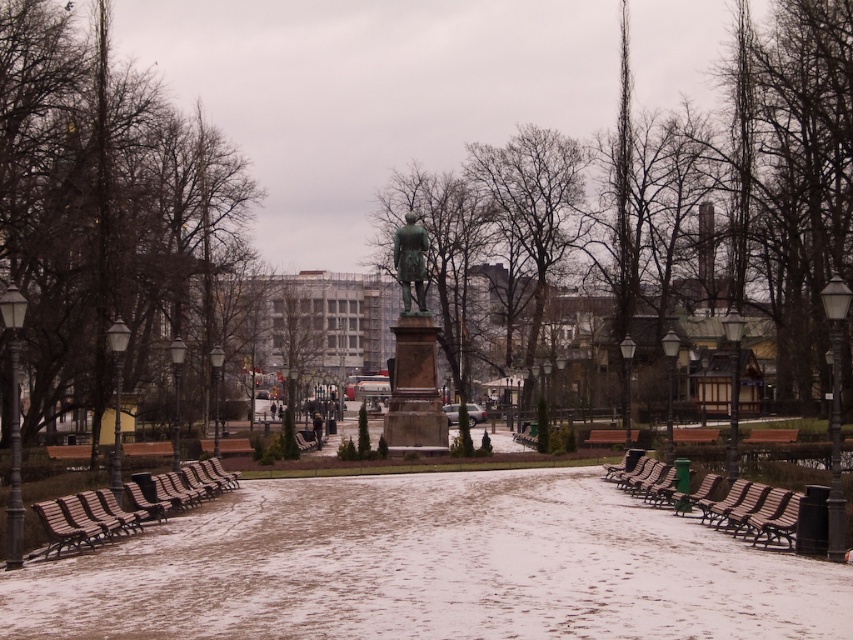
Question: Which of these objects is positioned farthest from the green patina statue at center?

Choices:
 (A) green polished statue at center
 (B) wooden park bench at lower left
 (C) bare branches at center

Answer: (C)

Question: Is wooden park bench at lower left bigger than green polished stone statue at center?

Choices:
 (A) yes
 (B) no

Answer: (A)

Question: Is green patina statue at center positioned in front of wooden park bench at lower left?

Choices:
 (A) no
 (B) yes

Answer: (A)

Question: Considering the real-world distances, which object is closest to the brown leafless tree at left?

Choices:
 (A) bare branches at center
 (B) green polished stone statue at center
 (C) green polished statue at center
 (D) green leafless tree at center

Answer: (C)

Question: Among these points, which one is farthest from the camera?

Choices:
 (A) coord(122,92)
 (B) coord(625,241)
 (C) coord(750,509)
 (D) coord(430,273)

Answer: (D)

Question: Does green leafless tree at center have a larger size compared to brown wooden bench at right?

Choices:
 (A) no
 (B) yes

Answer: (B)